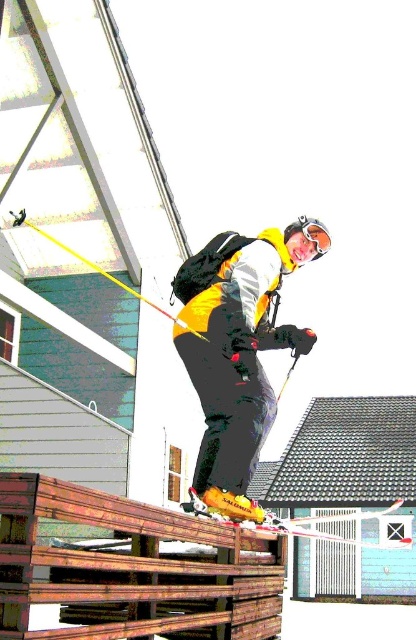
You are a winter sports instructor preparing to teach a beginner class. You need to ensure that the equipment spacing matches safety guidelines, which require a minimum of 3 feet between the ski and the pole. Based on the image provided, does the distance between the yellow matte ski at center and the yellow plastic ski pole at upper center meet the safety requirement?

Result: The distance between the yellow matte ski at center and the yellow plastic ski pole at upper center is 3.68 feet, which exceeds the minimum requirement of 3 feet. Therefore, the spacing meets the safety guidelines.

You are a photographer trying to capture the skier in midair. You notice the yellow metallic ski at center and the yellow plastic ski pole at upper center. Which object is closer to the camera based on their positions?

The yellow plastic ski pole at upper center is closer to the camera because it is positioned above the yellow metallic ski at center, which is placed underneath it.